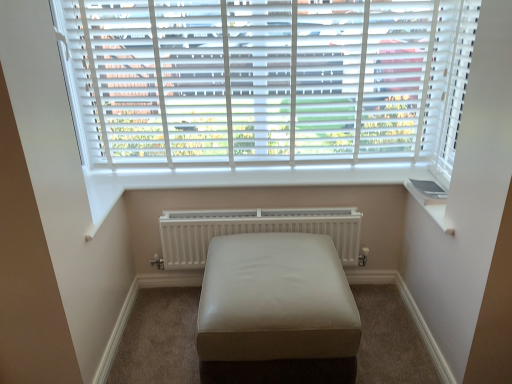
Question: In terms of width, does white matte blinds at upper center look wider or thinner when compared to beige leather ottoman at center?

Choices:
 (A) thin
 (B) wide

Answer: (A)

Question: Considering the positions of white matte blinds at upper center and beige leather ottoman at center in the image, is white matte blinds at upper center bigger or smaller than beige leather ottoman at center?

Choices:
 (A) small
 (B) big

Answer: (A)

Question: Estimate the real-world distances between objects in this image. Which object is farther from the white matte blinds at upper center?

Choices:
 (A) beige leather ottoman at center
 (B) white matte radiator at center

Answer: (A)

Question: Based on their relative distances, which object is nearer to the beige leather ottoman at center?

Choices:
 (A) white matte blinds at upper center
 (B) white matte radiator at center

Answer: (B)